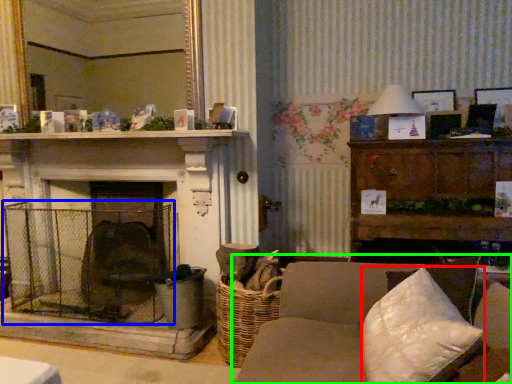
Question: Which is nearer to the pillow (highlighted by a red box)? cage (highlighted by a blue box) or studio couch (highlighted by a green box).

Choices:
 (A) cage
 (B) studio couch

Answer: (B)